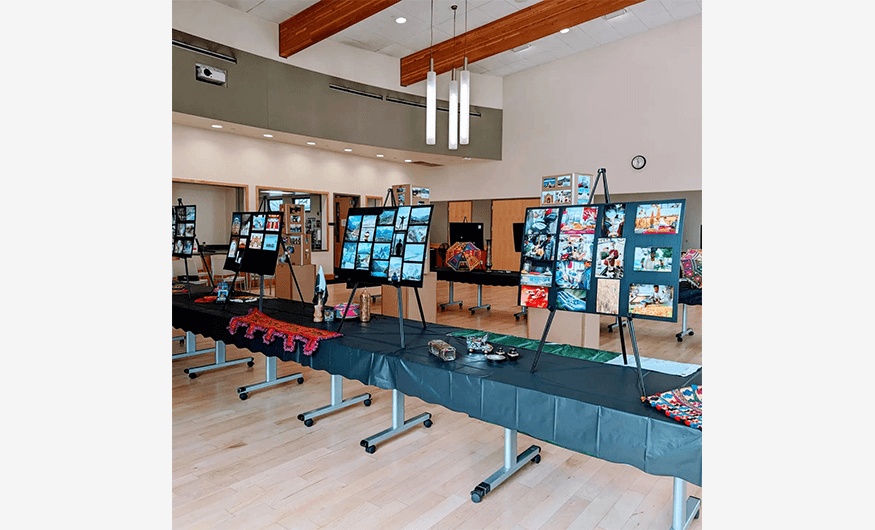
This screenshot has width=875, height=530. In order to click on table leg in this screenshot , I will do `click(501, 460)`, `click(393, 416)`, `click(262, 379)`.